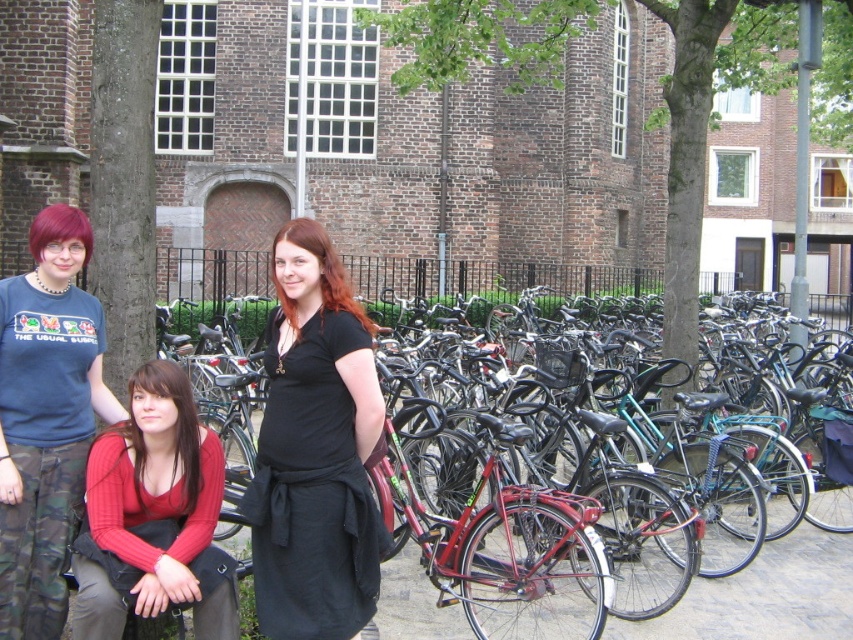
Question: In this image, where is green leafy tree at center located relative to shiny red bicycle at center?

Choices:
 (A) right
 (B) left

Answer: (B)

Question: Which of the following is the closest to the observer?

Choices:
 (A) shiny red bicycle at center
 (B) knitted red sweater at lower left
 (C) black matte dress at center

Answer: (B)

Question: Which object is closer to the camera taking this photo?

Choices:
 (A) green leafy tree at center
 (B) knitted red sweater at lower left

Answer: (B)

Question: Can you confirm if knitted red sweater at lower left is positioned above brown rough bark at left?

Choices:
 (A) yes
 (B) no

Answer: (B)

Question: Is knitted red sweater at lower left smaller than brown rough bark at left?

Choices:
 (A) yes
 (B) no

Answer: (B)

Question: Among these points, which one is nearest to the camera?

Choices:
 (A) (178, 381)
 (B) (469, 13)
 (C) (79, 227)
 (D) (108, 29)

Answer: (A)